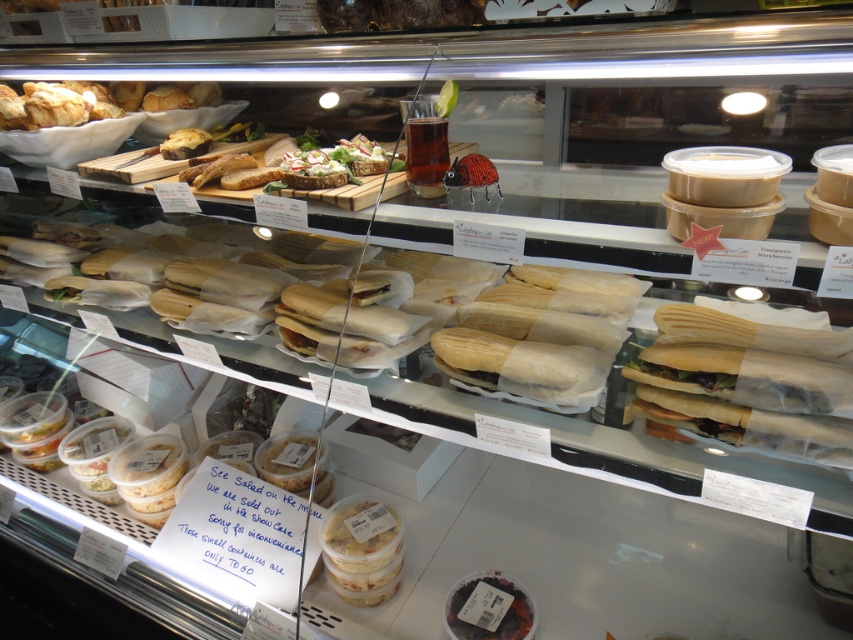
How much distance is there between translucent plastic salad container at center and golden brown croissant at upper left?

The distance of translucent plastic salad container at center from golden brown croissant at upper left is 3.75 feet.

Between translucent plastic salad container at center and golden brown croissant at upper left, which one appears on the left side from the viewer's perspective?

golden brown croissant at upper left

Who is more forward, (328, 570) or (171, 90)?

Point (328, 570) is in front.

Locate an element on the screen. Image resolution: width=853 pixels, height=640 pixels. translucent plastic salad container at center is located at coordinates (363, 548).

Which is above, translucent plastic salad container at center or dark purple matte cake at lower center?

Positioned higher is translucent plastic salad container at center.

Is translucent plastic salad container at center closer to camera compared to dark purple matte cake at lower center?

No, translucent plastic salad container at center is further to the viewer.

Is point (332, 586) positioned after point (486, 598)?

Yes, it is.

I want to click on translucent plastic salad container at center, so click(x=363, y=548).

Which is behind, point (45, 113) or point (496, 572)?

The point (45, 113) is more distant.

Does golden brown croissant at upper left lie behind dark purple matte cake at lower center?

Yes, golden brown croissant at upper left is further from the viewer.

Who is more distant from viewer, (165, 90) or (445, 608)?

Positioned behind is point (165, 90).

Image resolution: width=853 pixels, height=640 pixels. In order to click on golden brown croissant at upper left in this screenshot , I will do [x=90, y=102].